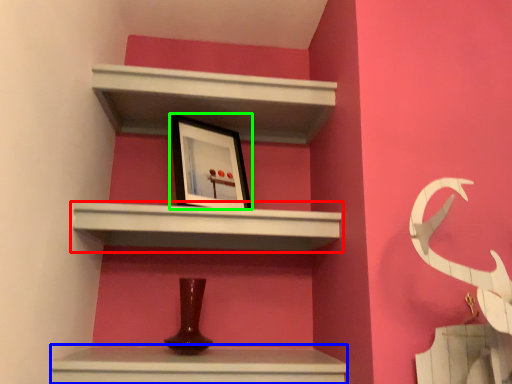
Question: Considering the real-world distances, which object is closest to shelf (highlighted by a red box)? vanity (highlighted by a blue box) or picture frame (highlighted by a green box).

Choices:
 (A) vanity
 (B) picture frame

Answer: (B)